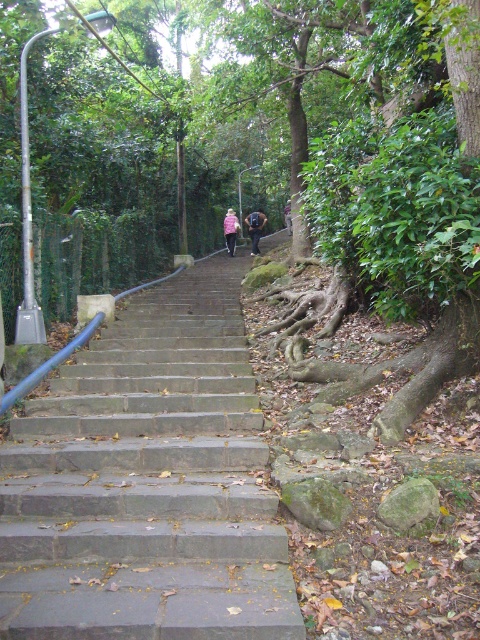
Who is higher up, gray concrete stairs at center or pink fabric at upper center?

pink fabric at upper center is higher up.

Is gray concrete stairs at center thinner than pink fabric at upper center?

No.

Between point (239, 620) and point (264, 221), which one is positioned in front?

Positioned in front is point (239, 620).

Where is `gray concrete stairs at center`? gray concrete stairs at center is located at coordinates (147, 483).

Which is more to the left, pink fabric at upper center or dark pink fabric at center?

From the viewer's perspective, pink fabric at upper center appears more on the left side.

Is pink fabric at upper center below dark pink fabric at center?

Indeed, pink fabric at upper center is positioned under dark pink fabric at center.

Which is in front, point (251, 212) or point (288, 216)?

Point (288, 216) is in front.

In order to click on pink fabric at upper center in this screenshot , I will do `click(254, 228)`.

Consider the image. Is pink fabric at upper center thinner than pink fabric jacket at upper center?

Yes.

Measure the distance between pink fabric at upper center and camera.

pink fabric at upper center is 19.46 meters away from camera.

Between point (260, 218) and point (230, 220), which one is positioned in front?

Point (260, 218) is more forward.

You are a GUI agent. You are given a task and a screenshot of the screen. Output one action in this format:
    pyautogui.click(x=<x>, y=<y>)
    Task: Click on the pink fabric at upper center
    
    Given the screenshot: What is the action you would take?
    point(254,228)